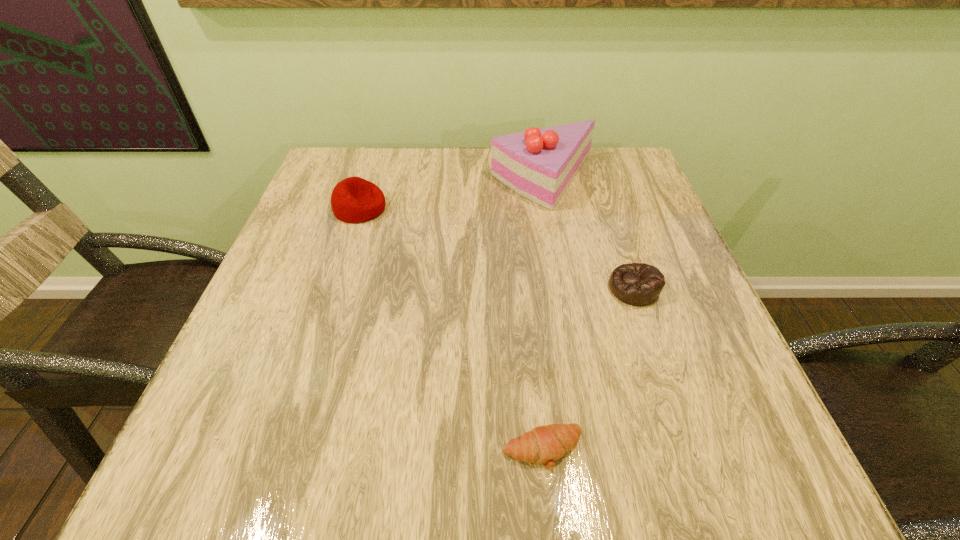
Find the location of a particular element. cake is located at coordinates point(539,164).

Find the location of a particular element. The width and height of the screenshot is (960, 540). the taller beanbag is located at coordinates (353, 200).

The width and height of the screenshot is (960, 540). I want to click on the left beanbag, so click(353, 200).

Where is `the right beanbag`? the right beanbag is located at coordinates (638, 284).

This screenshot has height=540, width=960. Find the location of `the third farthest object`. the third farthest object is located at coordinates (638, 284).

Where is `the nearest object`? The height and width of the screenshot is (540, 960). the nearest object is located at coordinates (545, 444).

This screenshot has width=960, height=540. I want to click on the shortest object, so click(545, 444).

At what (x,y) coordinates should I click in order to perform the action: click on free spot located on the front of the cake. Please return your answer as a coordinate pair (x, y). The width and height of the screenshot is (960, 540). Looking at the image, I should click on (556, 241).

Identify the location of vacant space located on the seat area of the second tallest object. The width and height of the screenshot is (960, 540). (541, 208).

The width and height of the screenshot is (960, 540). What are the coordinates of `vacant region located 0.270m on the back of the second nearest object` in the screenshot? It's located at (602, 194).